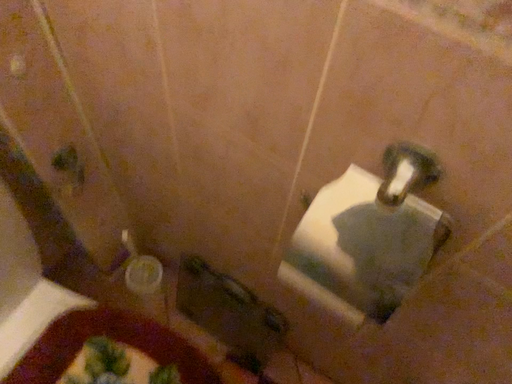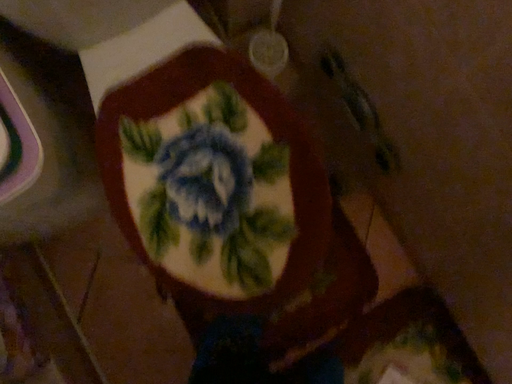
Question: Which way did the camera rotate in the video?

Choices:
 (A) rotated upward
 (B) rotated downward

Answer: (B)